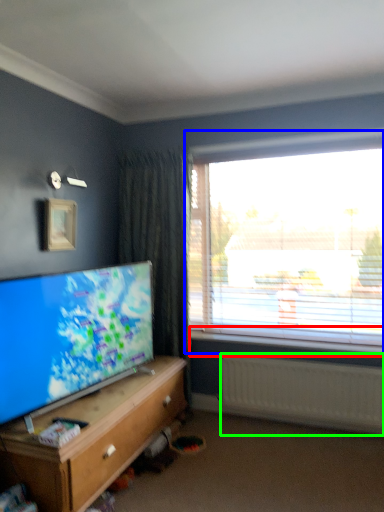
Question: Which object is positioned farthest from window sill (highlighted by a red box)? Select from window (highlighted by a blue box) and radiator (highlighted by a green box).

Choices:
 (A) window
 (B) radiator

Answer: (A)